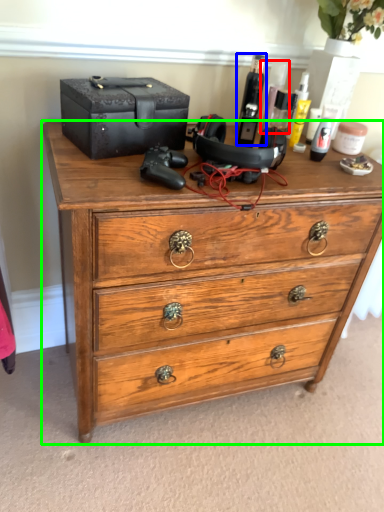
Question: Estimate the real-world distances between objects in this image. Which object is closer to toiletry (highlighted by a red box), toiletry (highlighted by a blue box) or chest of drawers (highlighted by a green box)?

Choices:
 (A) toiletry
 (B) chest of drawers

Answer: (A)